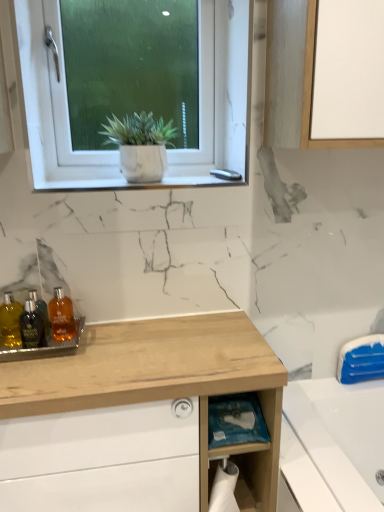
At what (x,y) coordinates should I click in order to perform the action: click on space that is in front of translucent amber bottle at lower left. Please return your answer as a coordinate pair (x, y). Looking at the image, I should click on (33, 373).